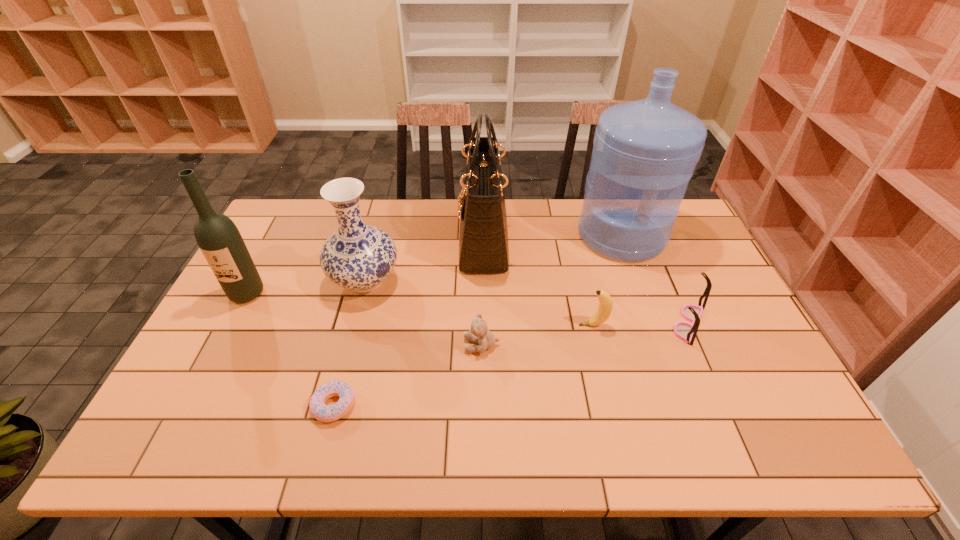
Locate an element on the screen. The image size is (960, 540). vacant region located at the front of the handbag with visible charms is located at coordinates (445, 242).

Where is `free spot located 0.220m at the front of the handbag with visible charms`? The height and width of the screenshot is (540, 960). free spot located 0.220m at the front of the handbag with visible charms is located at coordinates (394, 242).

Find the location of a particular element. The height and width of the screenshot is (540, 960). vacant space located at the front of the handbag with visible charms is located at coordinates (372, 242).

Locate an element on the screen. The width and height of the screenshot is (960, 540). free spot located on the labeled side of the leftmost object is located at coordinates (197, 389).

This screenshot has height=540, width=960. I want to click on free space located on the front of the fourth tallest object, so click(x=325, y=430).

The height and width of the screenshot is (540, 960). Find the location of `free space located from the stem of the banana`. free space located from the stem of the banana is located at coordinates (466, 325).

Locate an element on the screen. vacant area situated 0.290m from the stem of the banana is located at coordinates (473, 325).

At what (x,y) coordinates should I click in order to perform the action: click on vacant space located from the stem of the banana. Please return your answer as a coordinate pair (x, y). This screenshot has width=960, height=540. Looking at the image, I should click on (451, 325).

In order to click on free spot located on the left of the spectacles in this screenshot , I will do `click(526, 323)`.

I want to click on vacant space situated on the face of the second shortest object, so click(x=361, y=345).